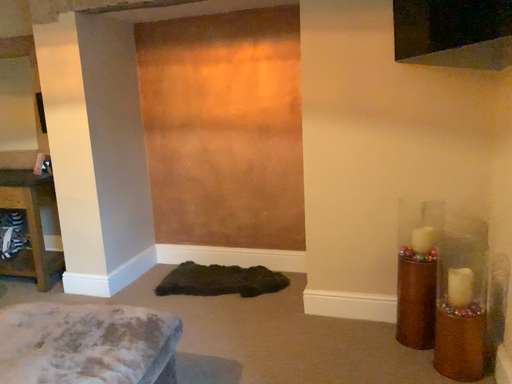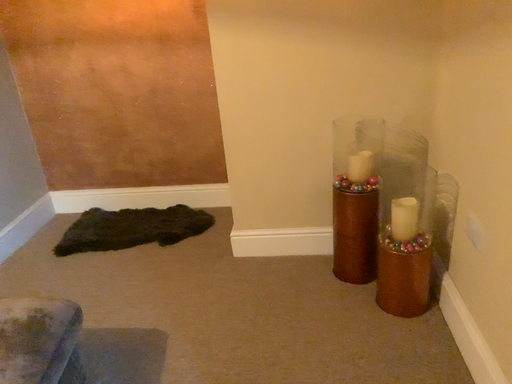
Question: How did the camera likely rotate when shooting the video?

Choices:
 (A) rotated right
 (B) rotated left

Answer: (A)